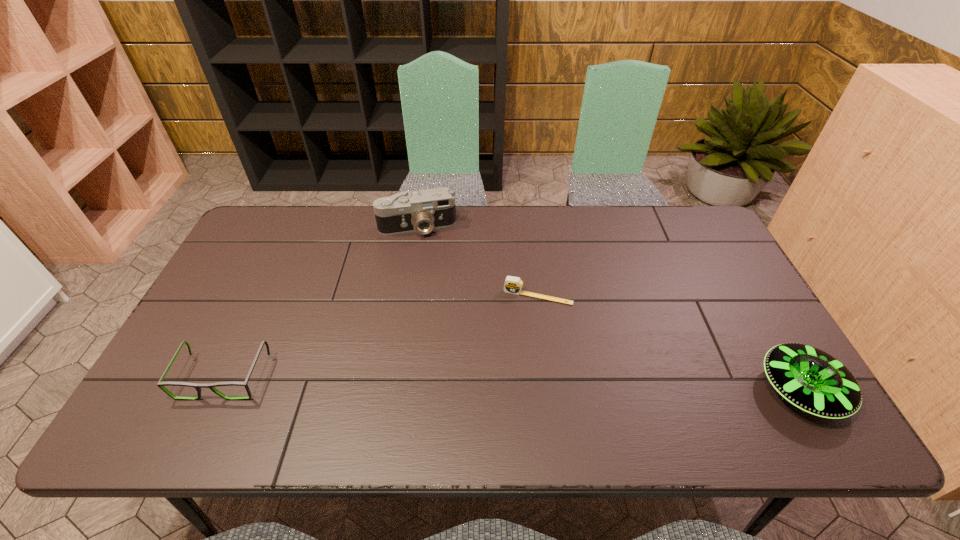
Locate an element on the screen. The height and width of the screenshot is (540, 960). free space between the second farthest object and the third tallest object is located at coordinates (381, 336).

This screenshot has height=540, width=960. In order to click on vacant space that's between the third object from right to left and the rightmost object in this screenshot , I will do `click(609, 309)`.

Where is `free point between the second object from left to right and the second object from right to left`? The width and height of the screenshot is (960, 540). free point between the second object from left to right and the second object from right to left is located at coordinates (478, 262).

The width and height of the screenshot is (960, 540). Identify the location of vacant space in between the farthest object and the second tallest object. (609, 309).

At what (x,y) coordinates should I click in order to perform the action: click on vacant space that is in between the tape measure and the saucer. Please return your answer as a coordinate pair (x, y). The width and height of the screenshot is (960, 540). Looking at the image, I should click on (669, 343).

The width and height of the screenshot is (960, 540). In order to click on free space between the camera and the third tallest object in this screenshot , I will do `click(321, 302)`.

Where is `vacant area that lies between the spectacles and the second object from left to right`? The width and height of the screenshot is (960, 540). vacant area that lies between the spectacles and the second object from left to right is located at coordinates (321, 302).

In order to click on object that is the second nearest to the rightmost object in this screenshot , I will do `click(405, 212)`.

Identify the location of the closest object relative to the third nearest object. (405, 212).

The height and width of the screenshot is (540, 960). I want to click on vacant region that satisfies the following two spatial constraints: 1. on the lens of the second tallest object; 2. on the left side of the spectacles, so click(218, 390).